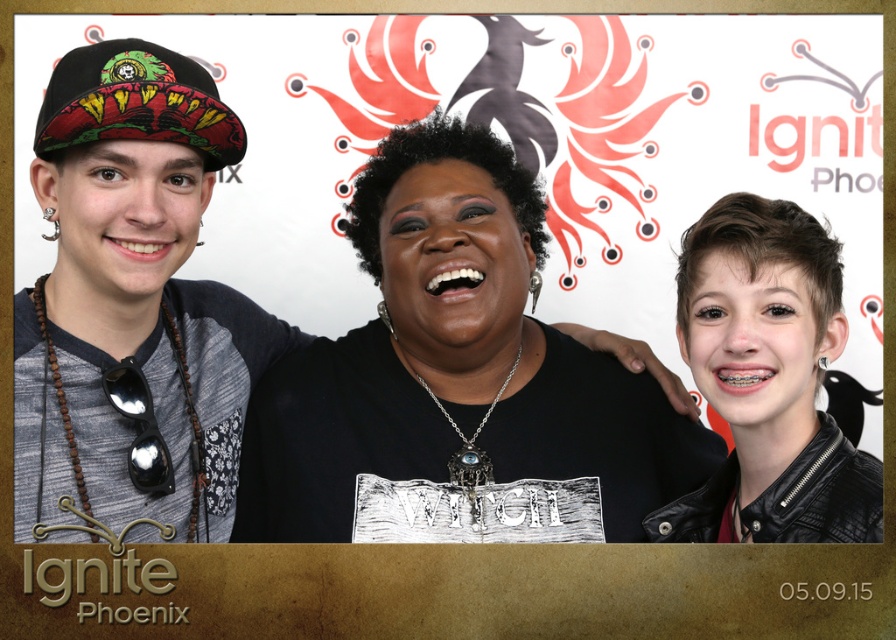
Is denim jacket at left above black leather jacket at right?

Correct, denim jacket at left is located above black leather jacket at right.

Between denim jacket at left and black leather jacket at right, which one appears on the left side from the viewer's perspective?

Positioned to the left is denim jacket at left.

What do you see at coordinates (132, 307) in the screenshot? I see `denim jacket at left` at bounding box center [132, 307].

Where is `denim jacket at left`? The height and width of the screenshot is (640, 896). denim jacket at left is located at coordinates (132, 307).